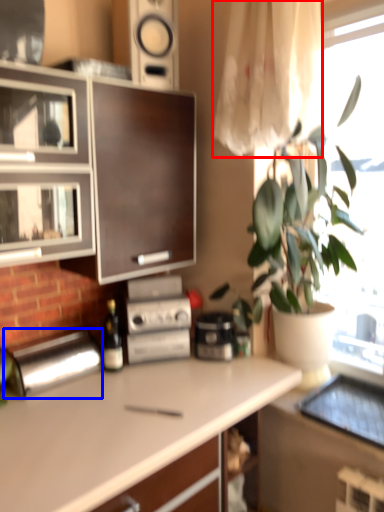
Question: Which point is closer to the camera, curtain (highlighted by a red box) or appliance (highlighted by a blue box)?

Choices:
 (A) curtain
 (B) appliance

Answer: (A)